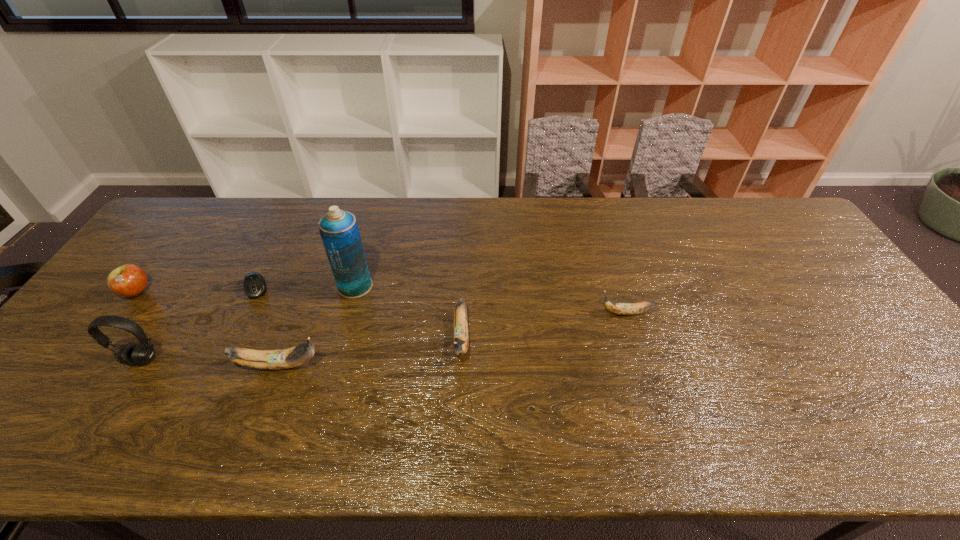
Where is `headset at the left edge`? The height and width of the screenshot is (540, 960). headset at the left edge is located at coordinates (142, 353).

You are a GUI agent. You are given a task and a screenshot of the screen. Output one action in this format:
    pyautogui.click(x=<x>, y=<y>)
    Task: Click on the apple situated at the left edge
    This screenshot has width=960, height=540.
    Given the screenshot: What is the action you would take?
    pyautogui.click(x=128, y=280)

In the image, there is a desktop. Identify the location of vacant space at the far edge. (241, 204).

The width and height of the screenshot is (960, 540). What are the coordinates of `free spot at the near edge of the desktop` in the screenshot? It's located at (139, 401).

This screenshot has width=960, height=540. I want to click on vacant region at the left edge of the desktop, so click(132, 316).

Where is `free space at the right edge`? The width and height of the screenshot is (960, 540). free space at the right edge is located at coordinates (789, 252).

You are a GUI agent. You are given a task and a screenshot of the screen. Output one action in this format:
    pyautogui.click(x=<x>, y=<y>)
    Task: Click on the vacant region at the far right corner of the desktop
    Image resolution: width=960 pixels, height=540 pixels.
    Given the screenshot: What is the action you would take?
    pyautogui.click(x=730, y=199)

Find the location of a particular element. This screenshot has width=960, height=540. vacant space in between the leftmost object and the shortest banana is located at coordinates (381, 302).

Where is `vacant space that is in between the sixth shortest object and the shortest banana`? This screenshot has width=960, height=540. vacant space that is in between the sixth shortest object and the shortest banana is located at coordinates (384, 336).

Identify the location of vacant space in between the fifth shortest object and the tallest object. (317, 326).